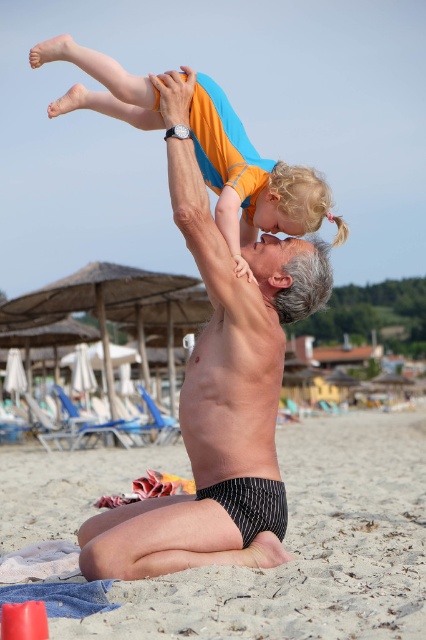
You are planning to set up a small tent for shade on the beach. The tent requires a clear area wider than the smooth skin man at center. Based on the scene, can you determine if the smooth beige sand at lower center provides enough width for the tent?

The smooth beige sand at lower center might be wider than the smooth skin man at center, so there is a possibility that the sand area is wide enough for the tent if the man is used as a reference for width.

Consider the image. You are standing at the beach and want to walk from point (388, 422) to point (198, 204). Which direction should you move in to get closer to your destination?

You should move towards the direction away from the viewer because point (388, 422) is further to the viewer than point (198, 204).

You are a photographer trying to capture the scene from the beach. You notice the smooth beige sand at lower center and the orange cotton shirt at upper center. Which object is located to the left of the other?

The smooth beige sand at lower center is positioned on the left side of orange cotton shirt at upper center.